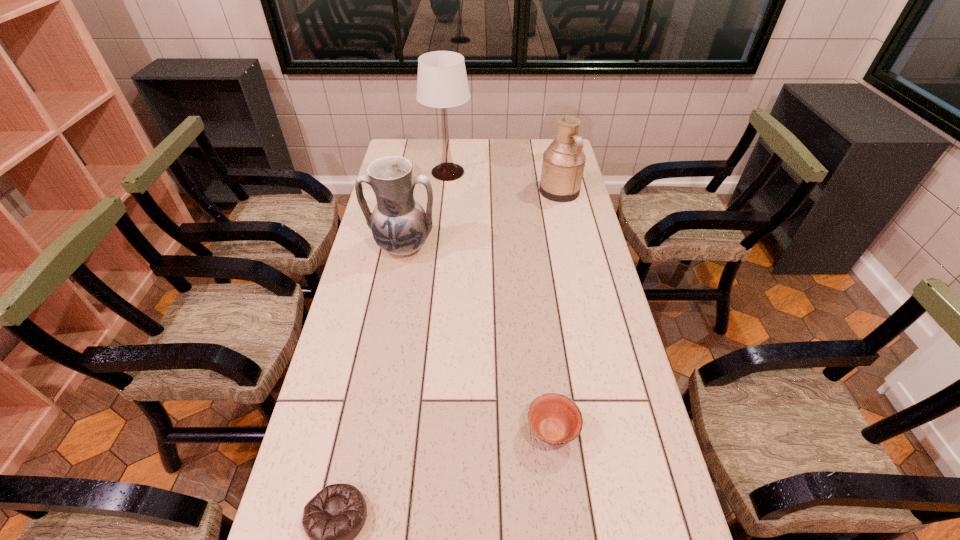
I want to click on the tallest object, so click(x=442, y=82).

Locate an element on the screen. the nearer pitcher is located at coordinates (400, 226).

This screenshot has height=540, width=960. What are the coordinates of `the left pitcher` in the screenshot? It's located at (400, 226).

Find the location of `the farther pitcher`. the farther pitcher is located at coordinates (563, 163).

Image resolution: width=960 pixels, height=540 pixels. What are the coordinates of `the right pitcher` in the screenshot? It's located at (563, 163).

The height and width of the screenshot is (540, 960). What are the coordinates of `the fourth object from left to right` in the screenshot? It's located at (554, 418).

I want to click on the second nearest object, so click(x=554, y=418).

I want to click on free spot located above the cylindrical shade of the table lamp, so [x=444, y=207].

This screenshot has height=540, width=960. Identify the location of vacant space located on the front-facing side of the third nearest object. (388, 327).

Where is `vacant region located on the left of the right pitcher`? This screenshot has height=540, width=960. vacant region located on the left of the right pitcher is located at coordinates (477, 191).